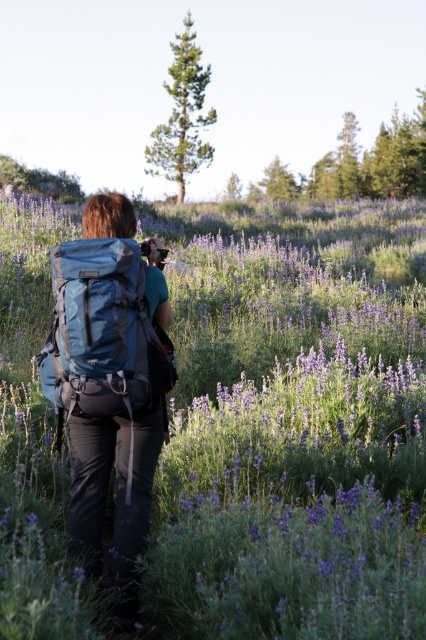
Can you confirm if purple soft lavender at center is positioned below teal fabric backpack at center?

No.

Who is positioned more to the right, purple soft lavender at center or teal fabric backpack at center?

Positioned to the right is purple soft lavender at center.

Between point (406, 474) and point (146, 324), which one is positioned behind?

Point (406, 474)

The image size is (426, 640). What are the coordinates of `purple soft lavender at center` in the screenshot? It's located at (291, 426).

The width and height of the screenshot is (426, 640). Describe the element at coordinates (291, 426) in the screenshot. I see `purple soft lavender at center` at that location.

Between point (388, 214) and point (140, 433), which one is positioned in front?

Point (140, 433)

Which is in front, point (175, 536) or point (143, 440)?

Point (175, 536) is in front.

Identify the location of purple soft lavender at center. This screenshot has width=426, height=640. (291, 426).

Who is more forward, [55,292] or [172,371]?

Point [55,292]

Does matte blue backpack at center appear on the right side of teal fabric backpack at center?

Indeed, matte blue backpack at center is positioned on the right side of teal fabric backpack at center.

Does point (129, 465) come closer to viewer compared to point (120, 332)?

No, it is behind (120, 332).

Identify the location of matte blue backpack at center. (111, 381).